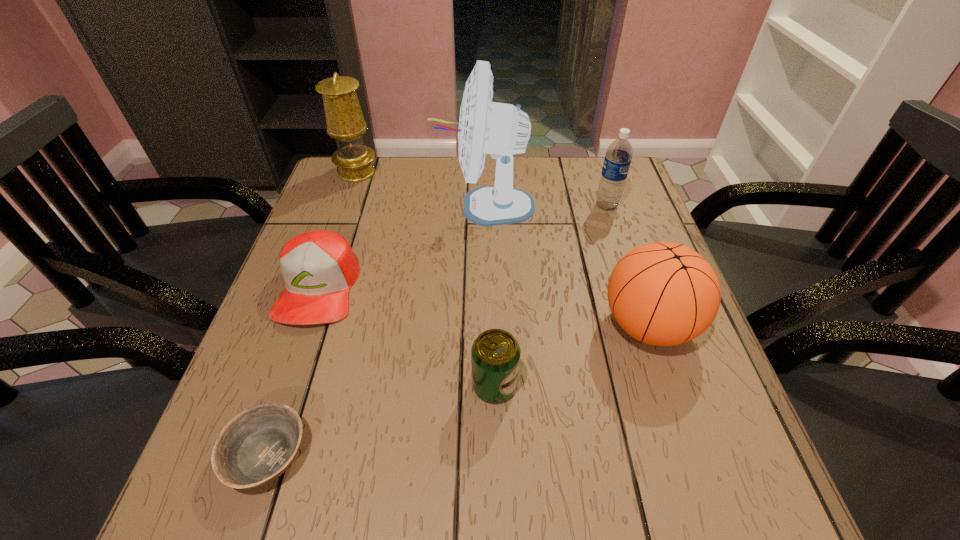
You are a GUI agent. You are given a task and a screenshot of the screen. Output one action in this format:
    pyautogui.click(x=<x>, y=<y>)
    Task: Click on the empty space that is in between the sixth tallest object and the basketball
    The image size is (960, 540).
    Given the screenshot: What is the action you would take?
    pyautogui.click(x=483, y=306)

Find the location of a particular element. The width and height of the screenshot is (960, 540). vacant area between the oil lamp and the baseball cap is located at coordinates (338, 230).

What are the coordinates of `the third closest object to the second shortest object` in the screenshot? It's located at (495, 354).

Locate which object is the fourth closest to the basketball. Please provide its 2D coordinates. Your answer should be formatted as a tuple, i.e. [(x, y)], where the tuple contains the x and y coordinates of a point satisfying the conditions above.

[(319, 267)]

Where is `vacant region that satisfies the following two spatial constraints: 1. on the back side of the water bottle; 2. on the right side of the nearest object`? vacant region that satisfies the following two spatial constraints: 1. on the back side of the water bottle; 2. on the right side of the nearest object is located at coordinates (351, 206).

Find the location of a particular element. Image resolution: width=960 pixels, height=540 pixels. free spot that satisfies the following two spatial constraints: 1. on the front-facing side of the beer can; 2. on the right side of the second shortest object is located at coordinates (284, 385).

This screenshot has width=960, height=540. I want to click on vacant space that satisfies the following two spatial constraints: 1. on the front-facing side of the shortest object; 2. on the left side of the second shortest object, so click(x=260, y=455).

Locate an element on the screen. The height and width of the screenshot is (540, 960). vacant space that satisfies the following two spatial constraints: 1. on the front-facing side of the second shortest object; 2. on the right side of the basketball is located at coordinates (305, 325).

This screenshot has height=540, width=960. I want to click on blank area in the image that satisfies the following two spatial constraints: 1. on the front side of the sixth shortest object; 2. on the left side of the bowl, so click(258, 455).